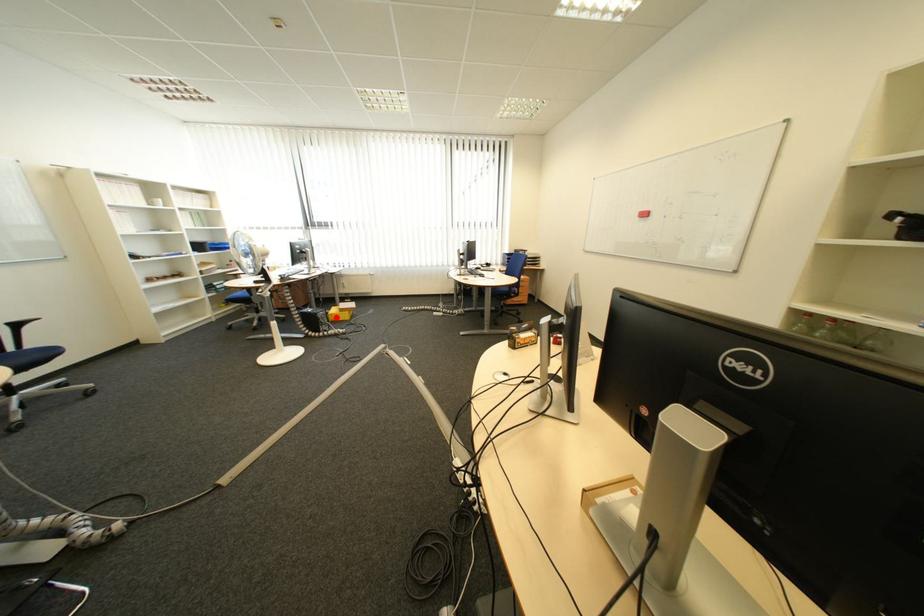
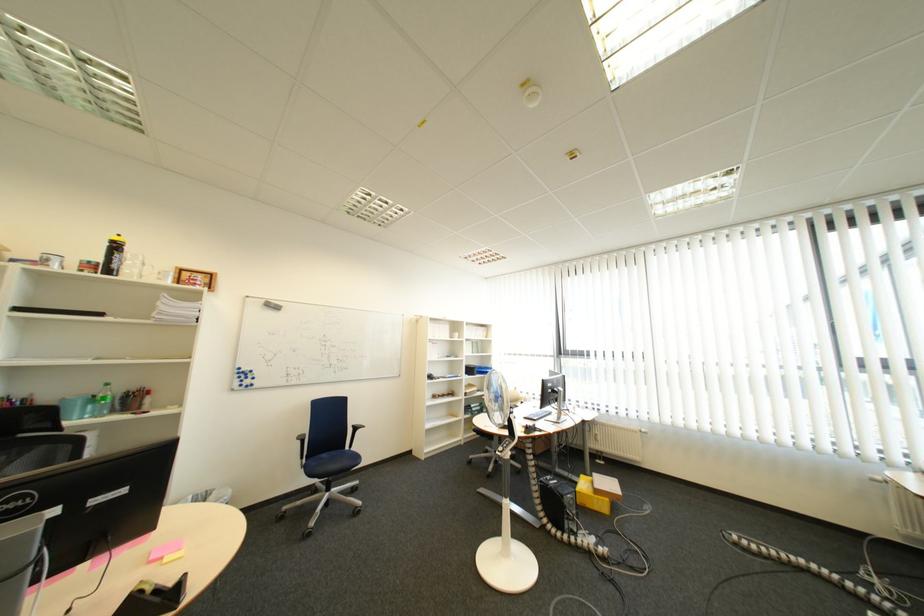
Question: I am providing you with two images of the same scene from different viewpoints. In image1, a red point is highlighted. Considering the same 3D point in image2, which of the following is correct?

Choices:
 (A) It is closer
 (B) It is farther

Answer: (B)